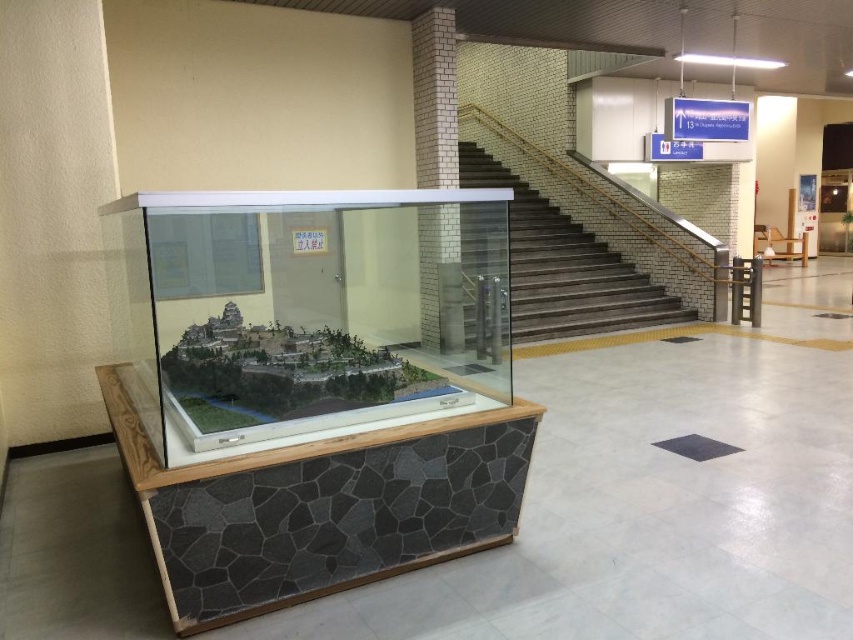
Is the position of clear acrylic display case at center less distant than that of dark brown wooden stairs at upper right?

Yes, it is.

Between clear acrylic display case at center and dark brown wooden stairs at upper right, which one is positioned higher?

dark brown wooden stairs at upper right is above.

Who is more forward, (392, 228) or (622, 284)?

Positioned in front is point (392, 228).

This screenshot has height=640, width=853. Identify the location of clear acrylic display case at center. (309, 308).